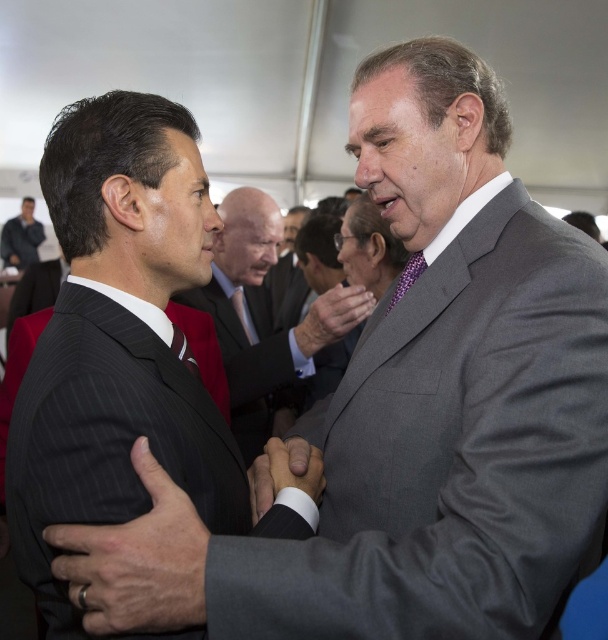
You are standing at the origin of the coordinate system in the image. Which of the two points, point (80,564) or point (401,273), is closer to you?

Point (80,564) is closer to you since it is in front of point (401,273).

Please provide the 2D coordinates of the black pinstripe suit at center in the image.

The 2D coordinates of the black pinstripe suit at center are at point (137,561).

You are a photographer at a formal event. You want to capture a photo of the black pinstripe suit at center and the smooth gray suit at center together in the same frame. The camera you are using has a minimum focus distance of 1 meter. Will both subjects be in focus if they remain at their current positions?

The black pinstripe suit at center and smooth gray suit at center are 1.14 meters apart. Since the minimum focus distance is 1 meter, the subjects are within range and will be in focus.